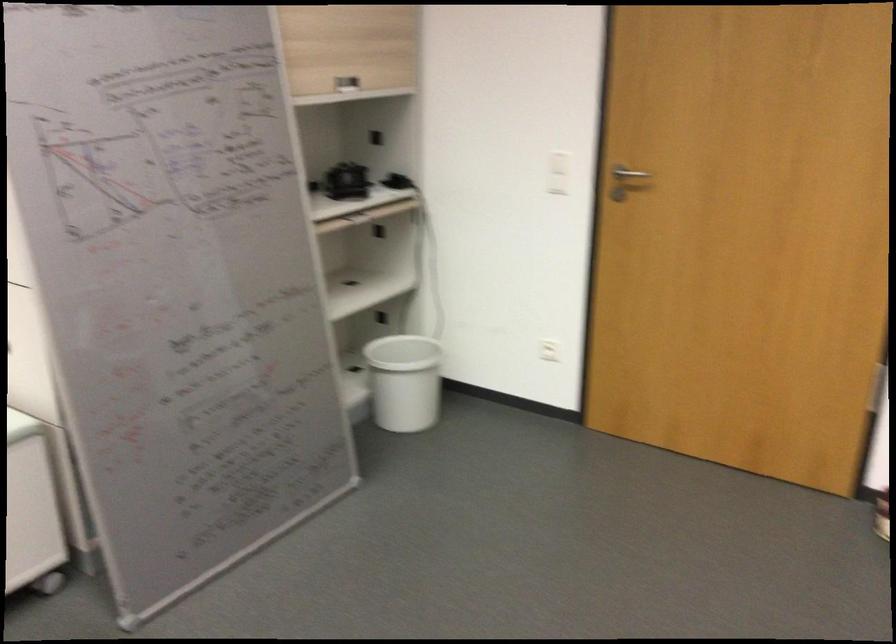
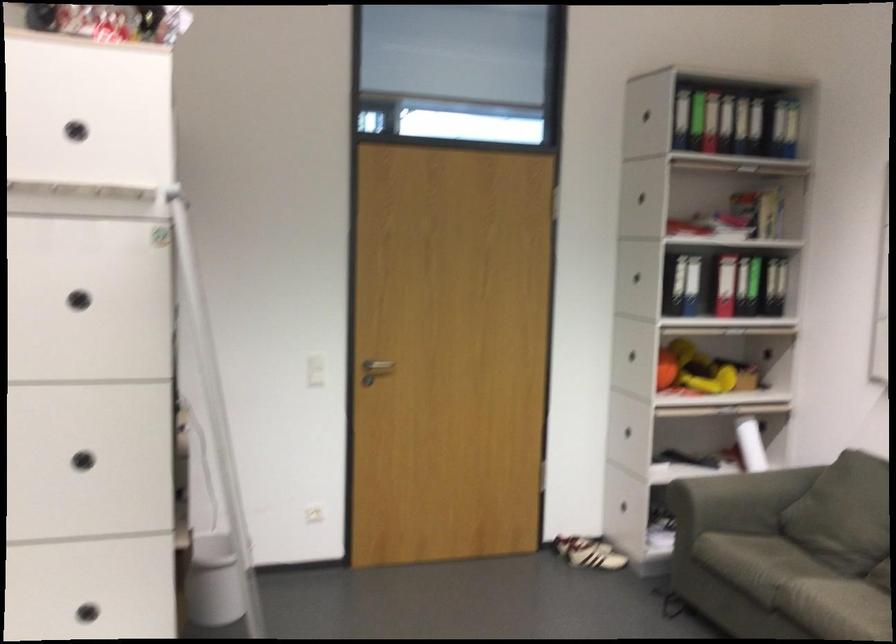
Find the pixel in the second image that matches point 676,190 in the first image.

(374, 370)